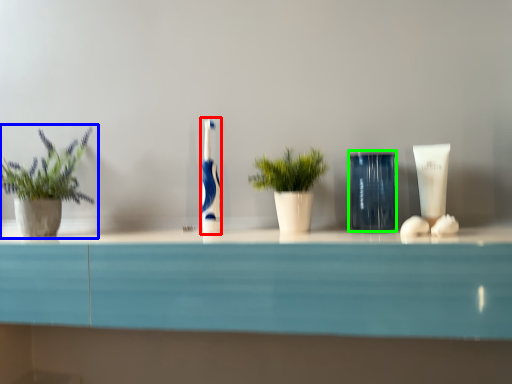
Question: Based on their relative distances, which object is nearer to toothbrush (highlighted by a red box)? Choose from houseplant (highlighted by a blue box) and glass vase (highlighted by a green box).

Choices:
 (A) houseplant
 (B) glass vase

Answer: (B)